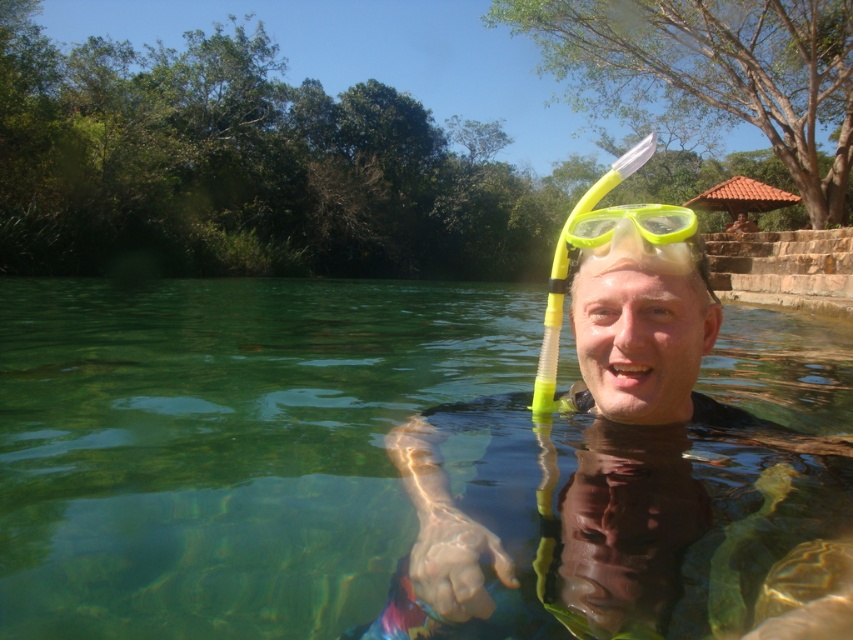
You are a lifeguard observing the scene. You notice the clear water at center and the yellow matte snorkel at center. Which object has a greater height in the image?

The clear water at center is much taller than the yellow matte snorkel at center.

You are navigating a small boat in the pool and need to pass between the two points marked as point (149, 634) and point (618, 332). Which point should you approach first to stay on course?

You should approach point (618, 332) first because point (149, 634) is behind it, meaning point (618, 332) is closer to your current position.

You are a swimmer who wants to adjust your equipment. You have the yellow matte snorkel at center and the yellow rubber goggles at center. Which one is located below the other?

The yellow matte snorkel at center is positioned under the yellow rubber goggles at center.